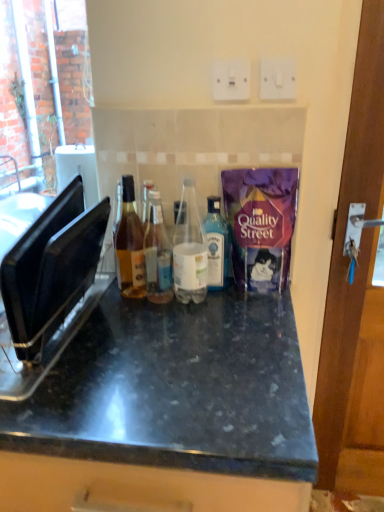
Identify the location of free space between translucent plastic bottle at center, the 2th bottle from the right, and black plastic toaster at left. This screenshot has height=512, width=384. (130, 326).